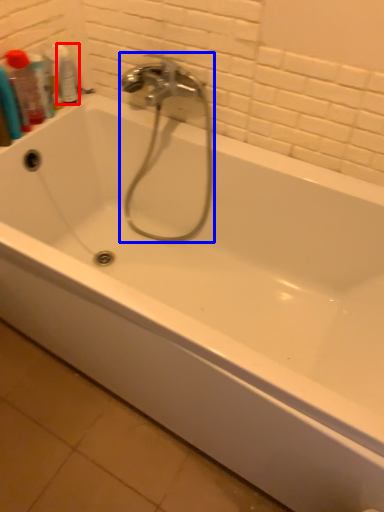
Question: Which object appears farthest to the camera in this image, mouthwash (highlighted by a red box) or faucet (highlighted by a blue box)?

Choices:
 (A) mouthwash
 (B) faucet

Answer: (A)